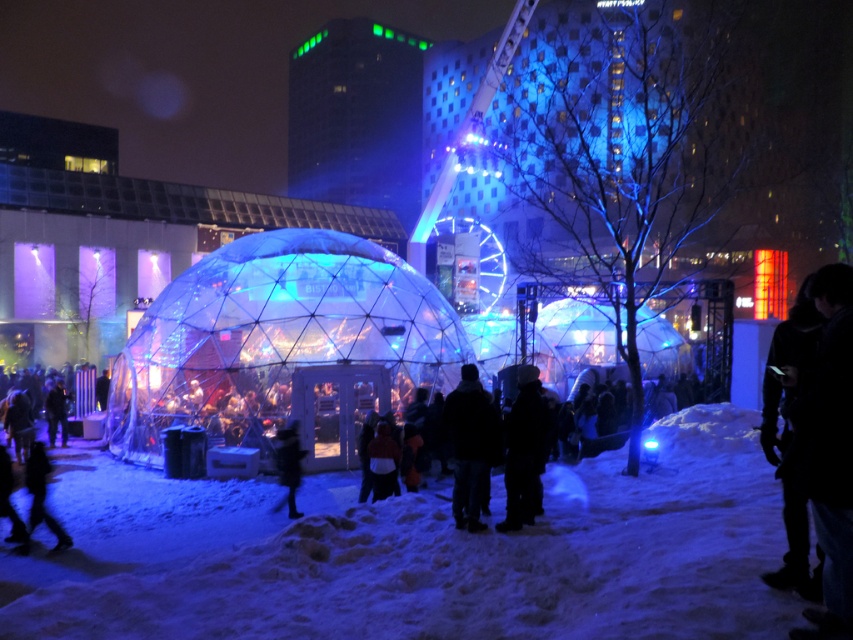
Looking at this image, between white powdery snow at center and black woolen hat at center, which one has more height?

black woolen hat at center

Which is in front, point (310, 538) or point (508, 516)?

Positioned in front is point (310, 538).

The width and height of the screenshot is (853, 640). Identify the location of white powdery snow at center. (485, 563).

What do you see at coordinates (485, 563) in the screenshot?
I see `white powdery snow at center` at bounding box center [485, 563].

Between white powdery snow at center and black fuzzy coat at lower center, which one has more height?

Standing taller between the two is black fuzzy coat at lower center.

Who is more distant from viewer, (244,589) or (283,438)?

The point (283,438) is behind.

At what (x,y) coordinates should I click in order to perform the action: click on white powdery snow at center. Please return your answer as a coordinate pair (x, y). Image resolution: width=853 pixels, height=640 pixels. Looking at the image, I should click on (485, 563).

This screenshot has width=853, height=640. What do you see at coordinates (469, 445) in the screenshot?
I see `dark wool coat at center` at bounding box center [469, 445].

Can you confirm if dark wool coat at center is positioned below black fuzzy coat at lower center?

No, dark wool coat at center is not below black fuzzy coat at lower center.

Does point (479, 512) lie behind point (292, 422)?

No, it is in front of (292, 422).

Locate an element on the screen. This screenshot has height=640, width=853. dark wool coat at center is located at coordinates (469, 445).